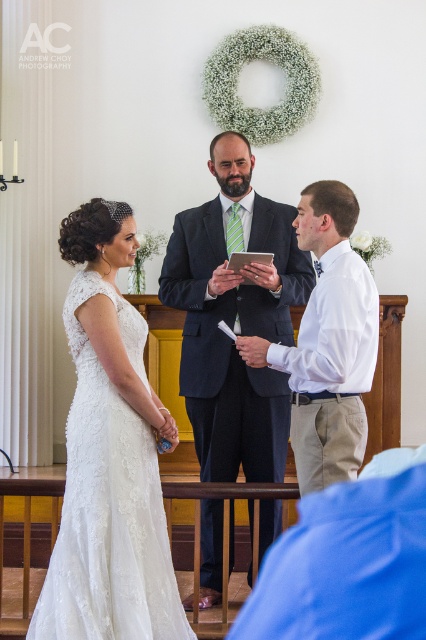
You are a photographer at a wedding and need to position yourself so that both the lace fabric dress at left and the white cotton shirt at center are visible in your shot. Based on their positions, which one should you focus on first to ensure both are in frame?

The lace fabric dress at left is located below the white cotton shirt at center, so you should focus on the white cotton shirt at center first to ensure both are in frame.

You are a photographer capturing the wedding ceremony. You need to ensure that both the white lace dress at left and the dark blue suit at center are in focus. Given that your camera has a depth of field that can cover 1 inch, will both subjects be in focus?

The white lace dress at left and dark blue suit at center are 0.88 inches apart, which is within the camera depth of field of 1 inch. Therefore, both subjects will be in focus.

You are a photographer at a wedding and need to frame the bride in her white lace dress at left and the groom in his dark blue suit at center. Given their clothing widths, which one should you adjust the camera focus on first to ensure proper framing?

The white lace dress at left has a lesser width compared to the dark blue suit at center, so you should focus on the dark blue suit at center first since it is wider and requires more space in the frame.